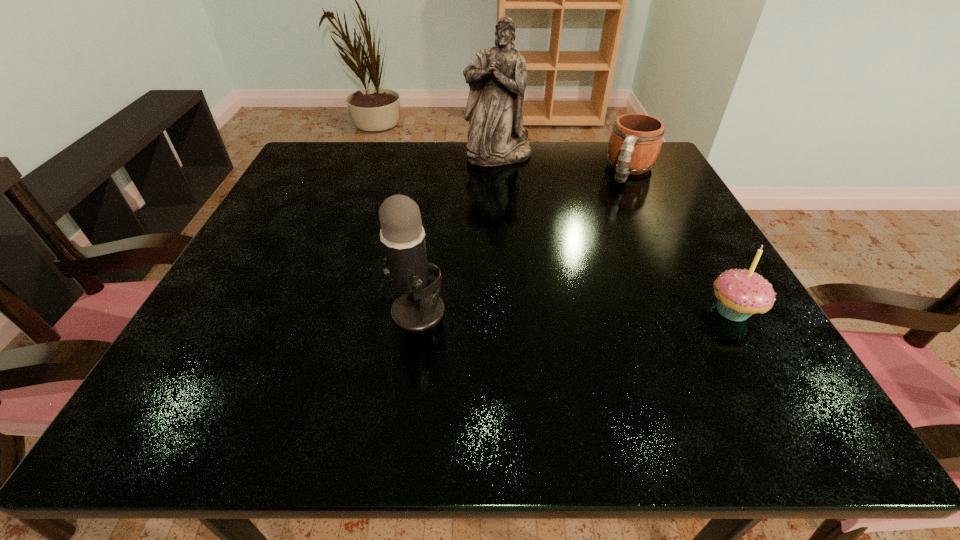
Locate an element on the screen. free space on the desktop that is between the third shortest object and the cupcake and is positioned on the front-facing side of the tallest object is located at coordinates (544, 312).

At what (x,y) coordinates should I click in order to perform the action: click on free space on the desktop that is between the leftmost object and the cupcake and is positioned on the side of the mug with the handle. Please return your answer as a coordinate pair (x, y). Looking at the image, I should click on (558, 312).